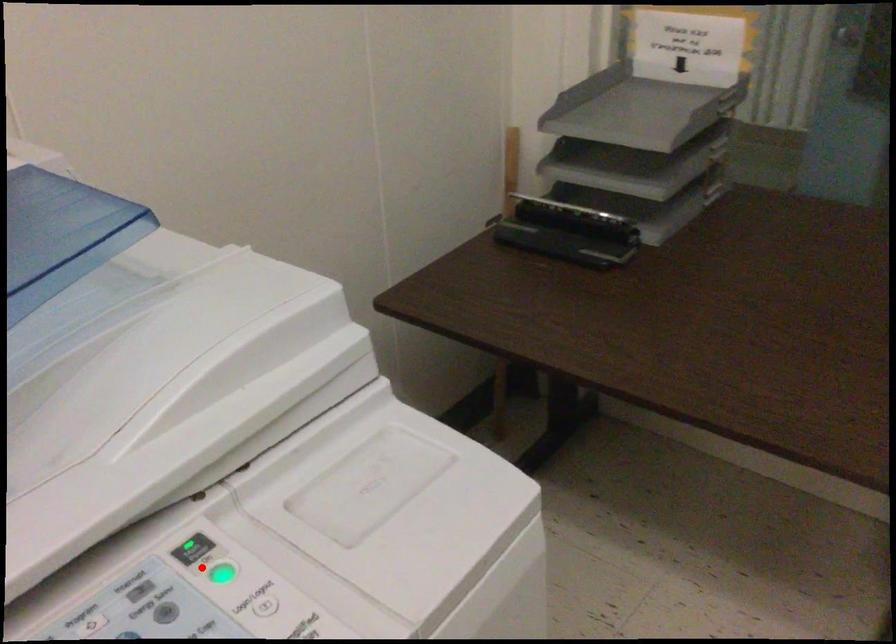
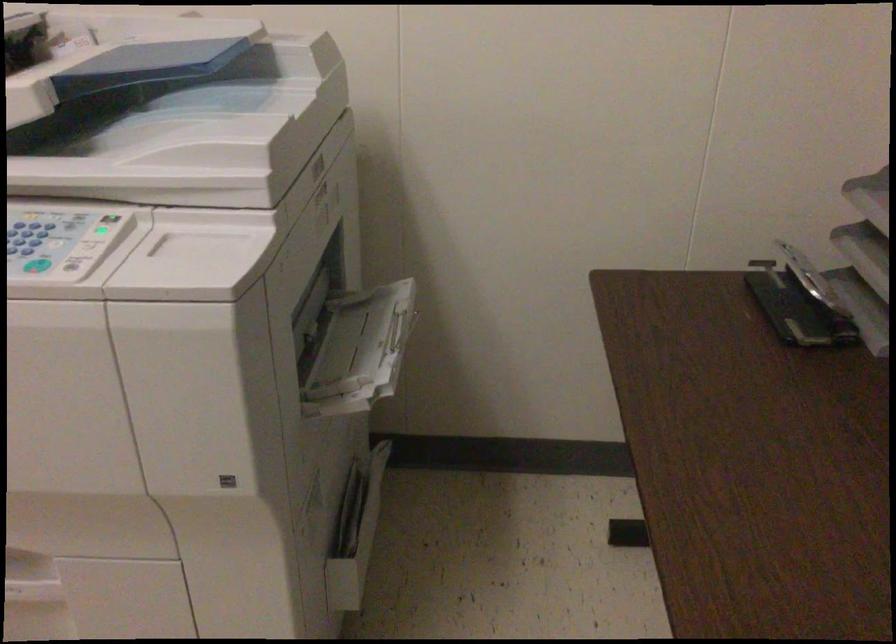
Question: I am providing you with two images of the same scene from different viewpoints. A red point is shown in image1. For the corresponding object point in image2, is it positioned nearer or farther from the camera?

Choices:
 (A) Nearer
 (B) Farther

Answer: (B)